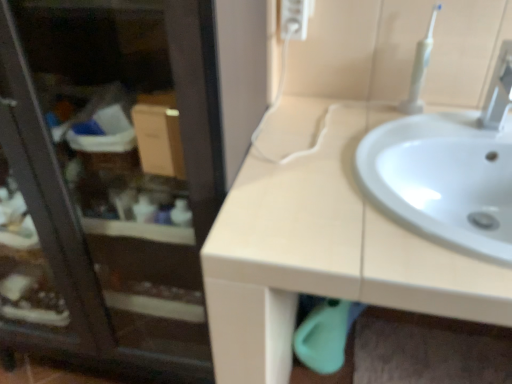
Question: From a real-world perspective, is white plastic tap at upper right under white glossy sink at center?

Choices:
 (A) yes
 (B) no

Answer: (B)

Question: Is white glossy sink at center at the back of white plastic tap at upper right?

Choices:
 (A) yes
 (B) no

Answer: (B)

Question: Can you confirm if white plastic tap at upper right is shorter than white glossy sink at center?

Choices:
 (A) yes
 (B) no

Answer: (B)

Question: Would you say white glossy sink at center is part of white plastic tap at upper right's contents?

Choices:
 (A) no
 (B) yes

Answer: (A)

Question: Is white plastic tap at upper right facing towards white glossy sink at center?

Choices:
 (A) no
 (B) yes

Answer: (A)

Question: Relative to white plastic toothbrush at upper right, is beige matte sink at upper right in front or behind?

Choices:
 (A) behind
 (B) front

Answer: (B)

Question: Is beige matte sink at upper right bigger or smaller than white plastic toothbrush at upper right?

Choices:
 (A) small
 (B) big

Answer: (B)

Question: Is point (364, 301) positioned closer to the camera than point (420, 64)?

Choices:
 (A) farther
 (B) closer

Answer: (B)

Question: From a real-world perspective, is beige matte sink at upper right above or below white plastic toothbrush at upper right?

Choices:
 (A) below
 (B) above

Answer: (A)

Question: Based on their sizes in the image, would you say beige matte sink at upper right is bigger or smaller than transparent glass screen door at upper left?

Choices:
 (A) big
 (B) small

Answer: (A)

Question: In terms of height, does beige matte sink at upper right look taller or shorter compared to transparent glass screen door at upper left?

Choices:
 (A) short
 (B) tall

Answer: (A)

Question: Does point (323, 249) appear closer or farther from the camera than point (172, 244)?

Choices:
 (A) farther
 (B) closer

Answer: (B)

Question: Considering the positions of beige matte sink at upper right and transparent glass screen door at upper left in the image, is beige matte sink at upper right wider or thinner than transparent glass screen door at upper left?

Choices:
 (A) thin
 (B) wide

Answer: (B)

Question: Based on their sizes in the image, would you say white plastic tap at upper right is bigger or smaller than beige matte sink at upper right?

Choices:
 (A) big
 (B) small

Answer: (B)

Question: From the image's perspective, is white plastic tap at upper right above or below beige matte sink at upper right?

Choices:
 (A) above
 (B) below

Answer: (A)